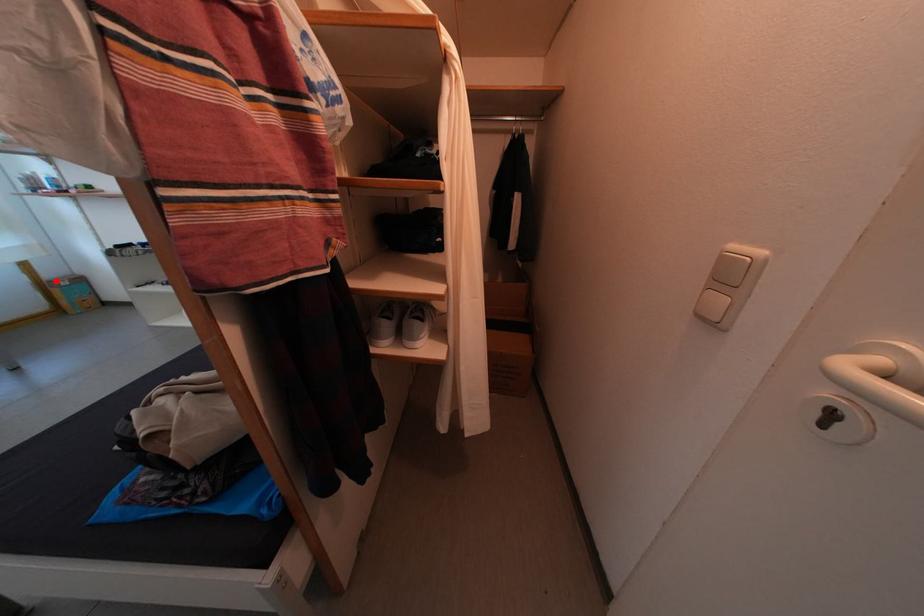
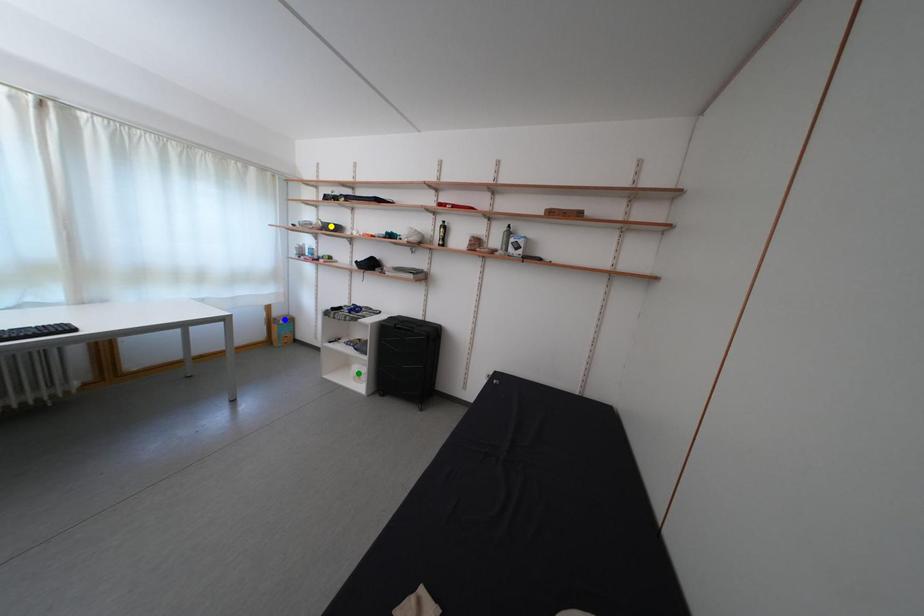
Question: I am providing you with two images of the same scene from different viewpoints. A red point is marked on the first image. You are given multiple points on the second image. Can you choose the point in image 2 that corresponds to the point in image 1?

Choices:
 (A) green point
 (B) blue point
 (C) yellow point

Answer: (B)